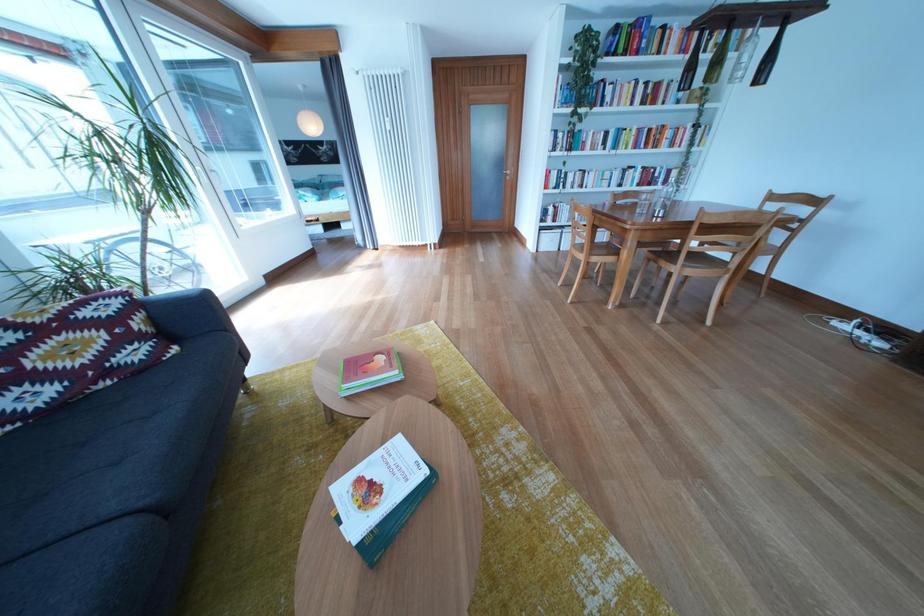
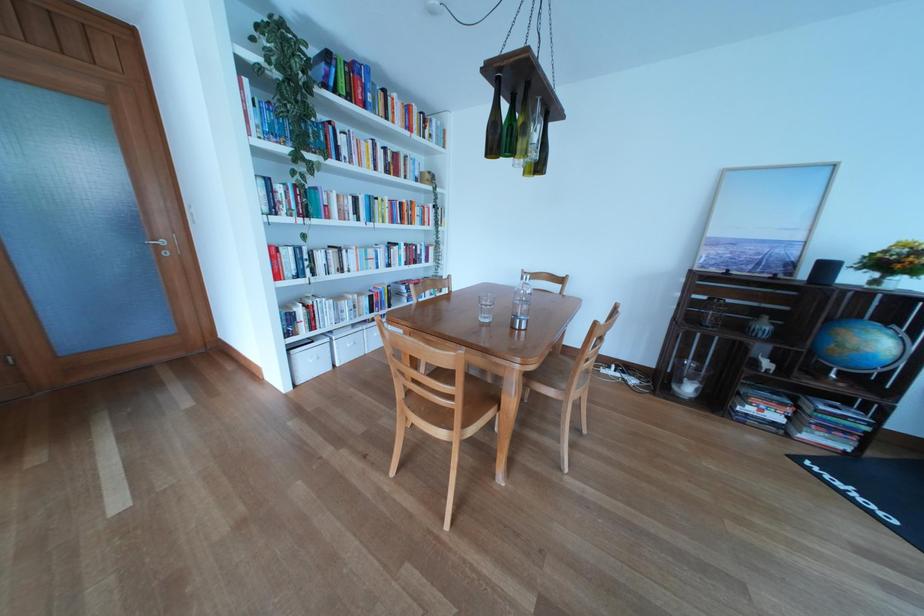
Locate, in the second image, the point that corresponds to point (650, 58) in the first image.

(378, 111)